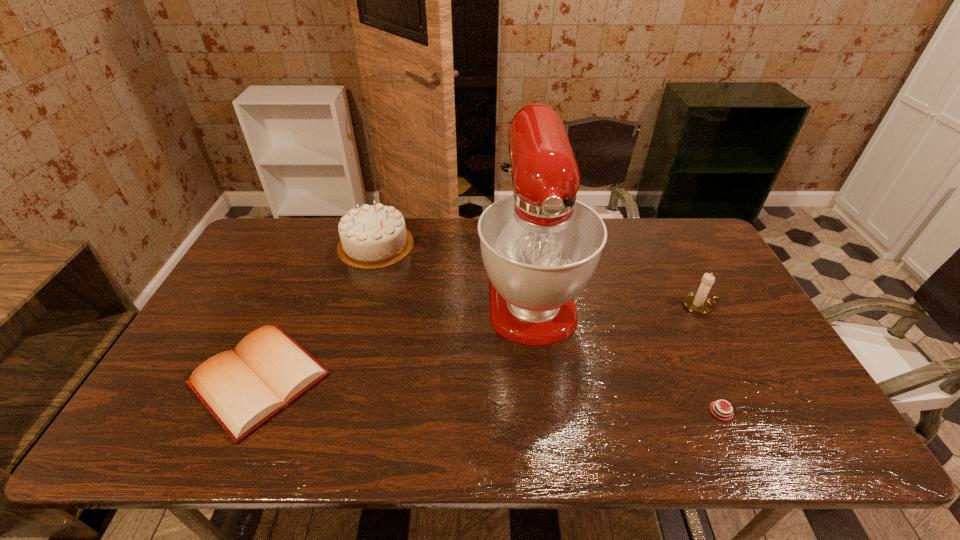
This screenshot has height=540, width=960. I want to click on unoccupied position between the chocolate cake and the Bible, so [491, 395].

I want to click on empty space that is in between the second shortest object and the third shortest object, so click(480, 342).

Identify the location of blank region between the tallest object and the candle holder. The height and width of the screenshot is (540, 960). (614, 296).

Locate an element on the screen. The height and width of the screenshot is (540, 960). vacant space that's between the fourth tallest object and the chocolate cake is located at coordinates (491, 395).

At what (x,y) coordinates should I click in order to perform the action: click on empty location between the third tallest object and the tallest object. Please return your answer as a coordinate pair (x, y). This screenshot has height=540, width=960. Looking at the image, I should click on (614, 296).

Where is `object that stands as the closest to the birthday cake`? This screenshot has width=960, height=540. object that stands as the closest to the birthday cake is located at coordinates (540, 246).

Select which object appears as the fourth closest to the mixer. Please provide its 2D coordinates. Your answer should be formatted as a tuple, i.e. [(x, y)], where the tuple contains the x and y coordinates of a point satisfying the conditions above.

[(244, 388)]

Where is `vacant space that satisfies the following two spatial constraints: 1. on the front side of the birthday cake; 2. on the left side of the shortest object`? vacant space that satisfies the following two spatial constraints: 1. on the front side of the birthday cake; 2. on the left side of the shortest object is located at coordinates (328, 411).